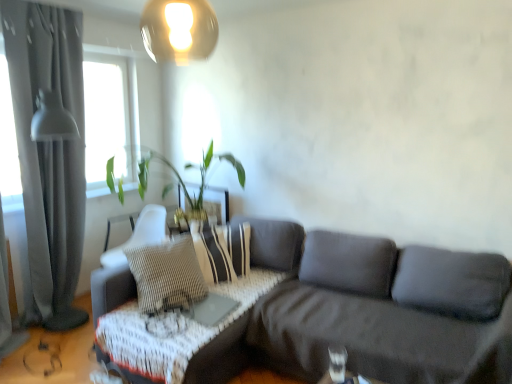
Question: Does woven fabric armchair at center appear on the right side of striped fabric pillow at center?

Choices:
 (A) yes
 (B) no

Answer: (B)

Question: Considering the relative positions of woven fabric armchair at center and striped fabric pillow at center in the image provided, is woven fabric armchair at center in front of striped fabric pillow at center?

Choices:
 (A) no
 (B) yes

Answer: (A)

Question: Considering the relative sizes of woven fabric armchair at center and striped fabric pillow at center in the image provided, is woven fabric armchair at center thinner than striped fabric pillow at center?

Choices:
 (A) yes
 (B) no

Answer: (B)

Question: Considering the relative sizes of woven fabric armchair at center and striped fabric pillow at center in the image provided, is woven fabric armchair at center shorter than striped fabric pillow at center?

Choices:
 (A) yes
 (B) no

Answer: (B)

Question: Is woven fabric armchair at center bigger than striped fabric pillow at center?

Choices:
 (A) yes
 (B) no

Answer: (A)

Question: Does point (61, 195) appear closer or farther from the camera than point (208, 261)?

Choices:
 (A) farther
 (B) closer

Answer: (A)

Question: Considering the relative positions of gray fabric curtain at left and striped fabric pillow at center in the image provided, is gray fabric curtain at left to the left or to the right of striped fabric pillow at center?

Choices:
 (A) right
 (B) left

Answer: (B)

Question: From a real-world perspective, is gray fabric curtain at left positioned above or below striped fabric pillow at center?

Choices:
 (A) below
 (B) above

Answer: (B)

Question: From the image's perspective, relative to striped fabric pillow at center, is gray fabric curtain at left above or below?

Choices:
 (A) above
 (B) below

Answer: (A)

Question: Looking at the image, does dark gray fabric couch at center seem bigger or smaller compared to wooden textured table at lower center, which is counted as the first table, starting from the front?

Choices:
 (A) big
 (B) small

Answer: (A)

Question: Is dark gray fabric couch at center to the left or to the right of wooden textured table at lower center, which ranks as the 1th table in right-to-left order, in the image?

Choices:
 (A) left
 (B) right

Answer: (A)

Question: From a real-world perspective, is dark gray fabric couch at center above or below wooden textured table at lower center, the second table in the left-to-right sequence?

Choices:
 (A) above
 (B) below

Answer: (A)

Question: Which is correct: dark gray fabric couch at center is inside wooden textured table at lower center, acting as the 2th table starting from the back, or outside of it?

Choices:
 (A) inside
 (B) outside

Answer: (B)

Question: Considering the positions of striped fabric pillow at center and dark gray fabric couch at center in the image, is striped fabric pillow at center wider or thinner than dark gray fabric couch at center?

Choices:
 (A) thin
 (B) wide

Answer: (A)

Question: From the image's perspective, is striped fabric pillow at center positioned above or below dark gray fabric couch at center?

Choices:
 (A) below
 (B) above

Answer: (B)